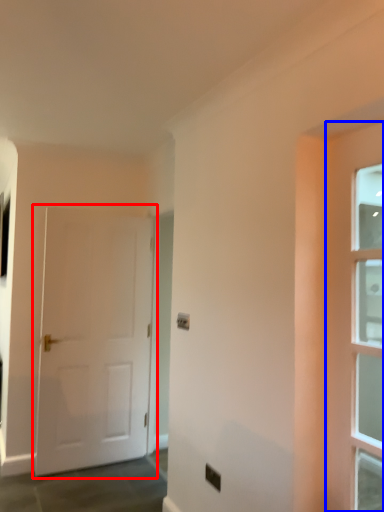
Question: Which point is closer to the camera, door (highlighted by a red box) or door (highlighted by a blue box)?

Choices:
 (A) door
 (B) door

Answer: (B)